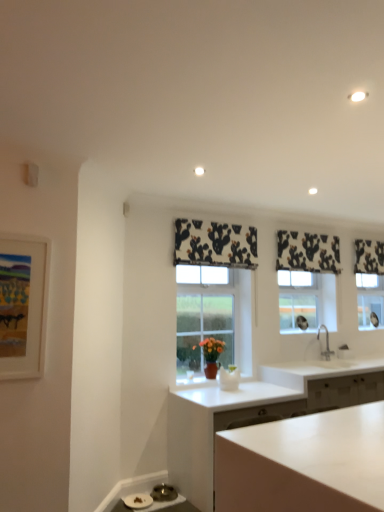
Question: Are black printed fabric at upper center, which is the 3th curtain from back to front, and black and white fabric at upper right, the third curtain viewed from the left, making contact?

Choices:
 (A) no
 (B) yes

Answer: (A)

Question: Is black printed fabric at upper center, the 1th curtain from the front, far from black and white fabric at upper right, the third curtain viewed from the front?

Choices:
 (A) yes
 (B) no

Answer: (A)

Question: Is black and white fabric at upper right, the third curtain viewed from the left, inside black printed fabric at upper center, which is the 1th curtain from left to right?

Choices:
 (A) yes
 (B) no

Answer: (B)

Question: From a real-world perspective, is black printed fabric at upper center, arranged as the third curtain when viewed from the right, positioned under black and white fabric at upper right, the third curtain viewed from the front, based on gravity?

Choices:
 (A) yes
 (B) no

Answer: (A)

Question: Is black printed fabric at upper center, which is the 3th curtain from back to front, smaller than black and white fabric at upper right, which ranks as the 1th curtain in right-to-left order?

Choices:
 (A) no
 (B) yes

Answer: (A)

Question: Based on their sizes in the image, would you say black printed fabric at upper center, the 2th curtain from the left, is bigger or smaller than white matte cabinet at center?

Choices:
 (A) small
 (B) big

Answer: (A)

Question: Do you think black printed fabric at upper center, the second curtain positioned from the front, is within white matte cabinet at center, or outside of it?

Choices:
 (A) outside
 (B) inside

Answer: (A)

Question: Is black printed fabric at upper center, the second curtain positioned from the back, taller or shorter than white matte cabinet at center?

Choices:
 (A) short
 (B) tall

Answer: (A)

Question: From the image's perspective, is black printed fabric at upper center, the second curtain positioned from the back, positioned above or below white matte cabinet at center?

Choices:
 (A) below
 (B) above

Answer: (B)

Question: Do you think silver metallic faucet at right is within white glossy countertop at lower right, or outside of it?

Choices:
 (A) inside
 (B) outside

Answer: (B)

Question: In terms of size, does silver metallic faucet at right appear bigger or smaller than white glossy countertop at lower right?

Choices:
 (A) big
 (B) small

Answer: (B)

Question: Is silver metallic faucet at right taller or shorter than white glossy countertop at lower right?

Choices:
 (A) tall
 (B) short

Answer: (A)

Question: Based on their positions, is silver metallic faucet at right located to the left or right of white glossy countertop at lower right?

Choices:
 (A) left
 (B) right

Answer: (A)

Question: Is matte white picture frame at left to the left or to the right of white matte cabinet at center in the image?

Choices:
 (A) right
 (B) left

Answer: (B)

Question: From a real-world perspective, is matte white picture frame at left above or below white matte cabinet at center?

Choices:
 (A) above
 (B) below

Answer: (A)